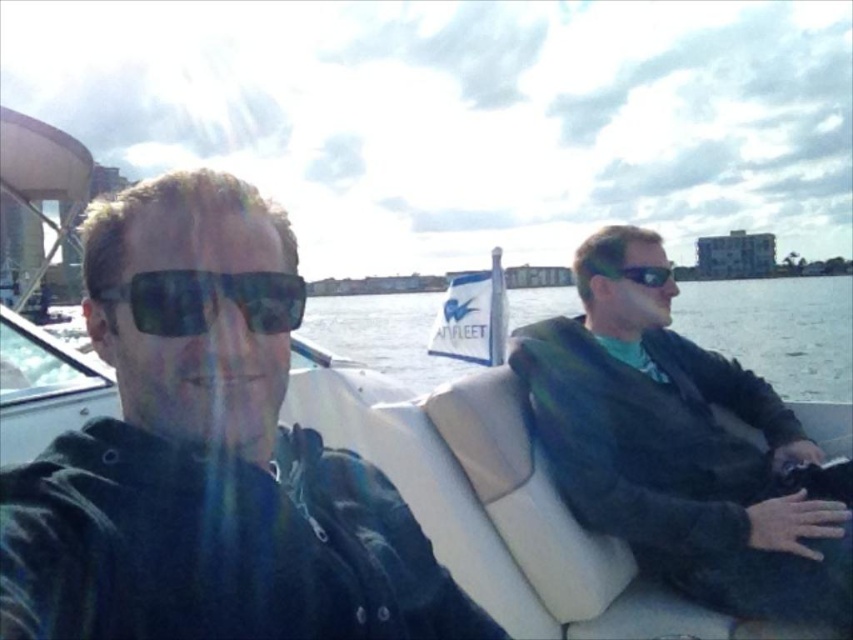
You are a photographer on the boat and want to capture a closeup shot of the green sweater at right and the black reflective sunglasses at right. Which object should you focus on first to avoid reflections from the water? Explain your reasoning.

The green sweater at right is located below the black reflective sunglasses at right. Since the sunglasses are higher up, they are more likely to reflect the water below, so focusing on the sweater first would minimize reflection issues.

You are a photographer on the boat and want to capture a photo of the matte black jacket at left and the clear water at center. Which object is closer to the camera when taking the photo from the boat?

The matte black jacket at left is positioned under clear water at center, so the clear water at center is closer to the camera than the matte black jacket at left.